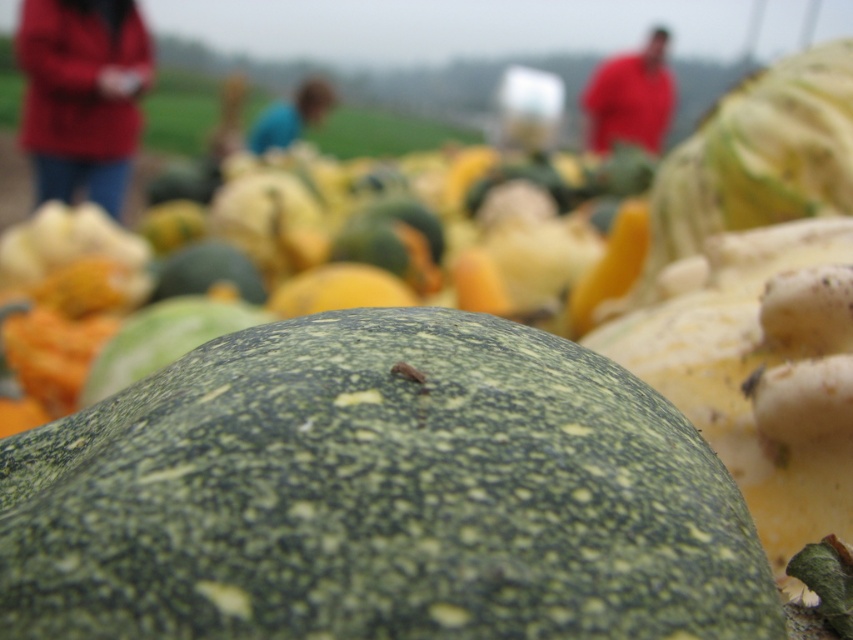
Question: Can you confirm if green rough gourd at center is smaller than matte red jacket at upper left?

Choices:
 (A) no
 (B) yes

Answer: (B)

Question: Which of the following is the farthest from the observer?

Choices:
 (A) (606, 124)
 (B) (717, 540)

Answer: (A)

Question: Which object appears farthest from the camera in this image?

Choices:
 (A) green rough gourd at center
 (B) blue fabric shirt at center

Answer: (B)

Question: Can you confirm if green rough gourd at center is positioned above matte red jacket at upper left?

Choices:
 (A) yes
 (B) no

Answer: (B)

Question: Which is farther from the matte red jacket at upper left?

Choices:
 (A) red cotton shirt at upper right
 (B) blue fabric shirt at center
 (C) green rough gourd at center

Answer: (C)

Question: Does matte red jacket at upper left have a smaller size compared to blue fabric shirt at center?

Choices:
 (A) no
 (B) yes

Answer: (A)